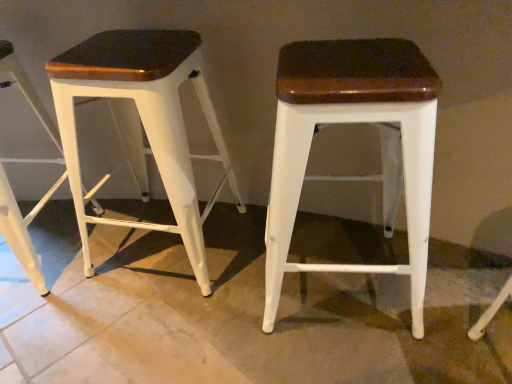
Question: In the image, is matte white stool at center, the third stool when ordered from left to right, on the left side or the right side of matte white stool at left, which is counted as the 2th stool, starting from the left?

Choices:
 (A) right
 (B) left

Answer: (A)

Question: From the image's perspective, relative to matte white stool at left, which is counted as the 2th stool, starting from the left, is matte white stool at center, the third stool when ordered from left to right, above or below?

Choices:
 (A) below
 (B) above

Answer: (A)

Question: Estimate the real-world distances between objects in this image. Which object is farther from the matte white stool at center, positioned as the first stool in right-to-left order?

Choices:
 (A) matte white stool at left, which is the second stool from right to left
 (B) matte white stool at left, which is the 1th stool from left to right

Answer: (B)

Question: Which is farther from the matte white stool at center, positioned as the first stool in right-to-left order?

Choices:
 (A) matte white stool at left, which is counted as the 2th stool, starting from the left
 (B) matte white stool at left, which is the 1th stool from left to right

Answer: (B)